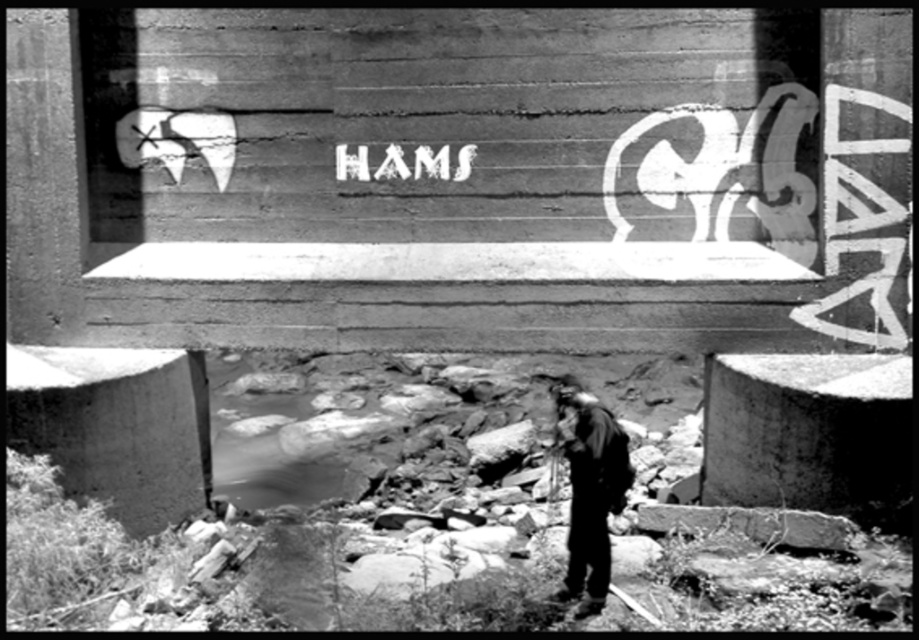
You are a photographer standing at the edge of the stream in the urban scene. You want to capture both the dark gray fabric jacket at lower center and the white matte text at center in the same frame. Given that your camera has a fixed focal length, can you adjust your position to include both objects without zooming? Explain your reasoning based on their distance apart.

The dark gray fabric jacket at lower center and the white matte text at center are 7.51 feet apart. Since the photographer can move closer or farther away from the objects to adjust the framing, as long as the camera can accommodate the 7.51 feet distance within its field of view at the current focal length, it is possible to include both in the frame without zooming. Positioning yourself appropriately to ensure both are within the shot would depend on the camera sensor and lens specifications, but the key

You are a photographer standing in the urban scene shown. You notice a dark gray fabric jacket at lower center and a white matte text at center. Which object is positioned to the right of the other?

The dark gray fabric jacket at lower center is to the right of white matte text at center.

You are a photographer standing at the center of the urban scene. You want to place a dark gray fabric jacket at lower center in your composition. Where should you position it relative to the central concrete structure?

The dark gray fabric jacket at lower center should be positioned at coordinates point (588,490) relative to the central concrete structure.